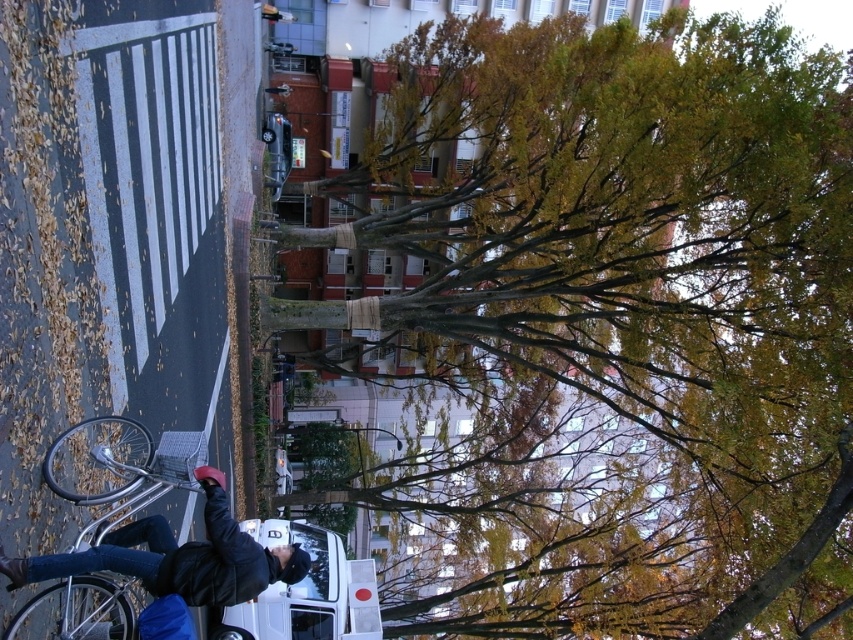
Question: Observing the image, what is the correct spatial positioning of green leafy tree at upper center in reference to dark blue jeans at lower left?

Choices:
 (A) right
 (B) left

Answer: (A)

Question: Which of the following is the closest to the observer?

Choices:
 (A) (566, 104)
 (B) (96, 598)
 (C) (260, 632)
 (D) (209, 531)

Answer: (B)

Question: Is green leafy tree at upper center to the right of white matte van at center from the viewer's perspective?

Choices:
 (A) no
 (B) yes

Answer: (B)

Question: Based on their relative distances, which object is farther from the green leafy tree at upper center?

Choices:
 (A) silver metallic bicycle at lower left
 (B) dark blue jeans at lower left

Answer: (A)

Question: Which point is farther to the camera?

Choices:
 (A) silver metallic bicycle at lower left
 (B) white matte van at center
 (C) green leafy tree at upper center
 (D) dark blue jeans at lower left

Answer: (B)

Question: Is silver metallic bicycle at lower left positioned at the back of white matte van at center?

Choices:
 (A) yes
 (B) no

Answer: (B)